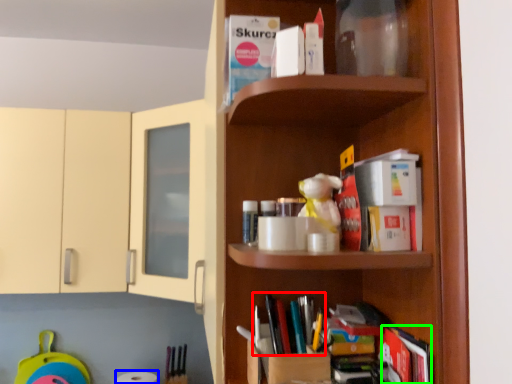
Question: Which is farther away from book (highlighted by a red box)? toilet paper (highlighted by a blue box) or book (highlighted by a green box)?

Choices:
 (A) toilet paper
 (B) book

Answer: (A)